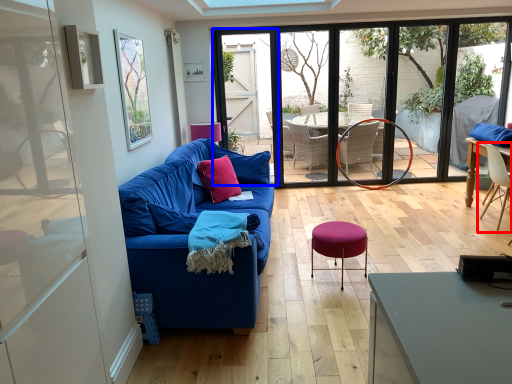
Question: Which object is closer to the camera taking this photo, chair (highlighted by a red box) or screen door (highlighted by a blue box)?

Choices:
 (A) chair
 (B) screen door

Answer: (A)